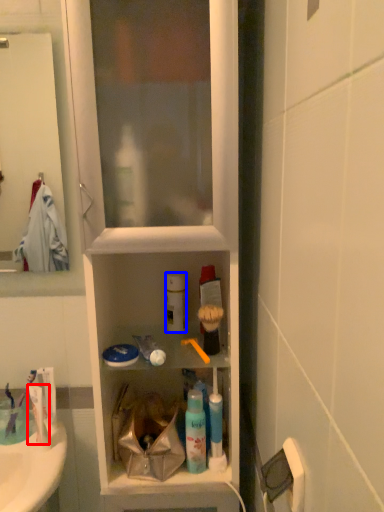
Question: Which of the following is the farthest to the observer, toothpaste (highlighted by a red box) or cleaning product (highlighted by a blue box)?

Choices:
 (A) toothpaste
 (B) cleaning product

Answer: (B)